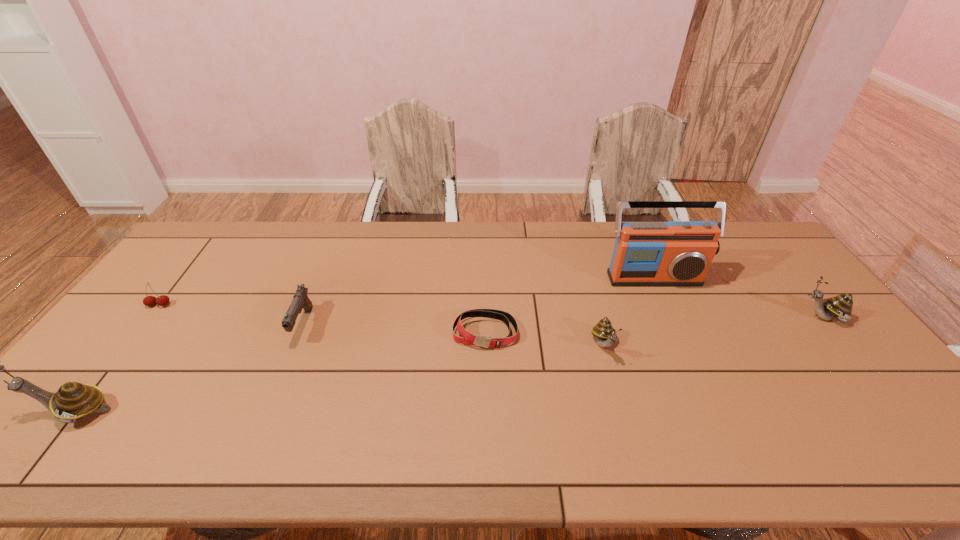
At what (x,y) coordinates should I click in order to perform the action: click on the nearest snail. Please return your answer as a coordinate pair (x, y). This screenshot has height=540, width=960. Looking at the image, I should click on (73, 401).

Find the location of a particular element. The image size is (960, 540). the leftmost snail is located at coordinates (73, 401).

Locate an element on the screen. the fourth tallest object is located at coordinates (606, 335).

In order to click on the second snail from right to left in this screenshot , I will do `click(606, 335)`.

What are the coordinates of `the third tallest object` in the screenshot? It's located at (839, 307).

I want to click on the rightmost object, so click(839, 307).

Locate an element on the screen. This screenshot has height=540, width=960. the second object from right to left is located at coordinates (676, 253).

You are a GUI agent. You are given a task and a screenshot of the screen. Output one action in this format:
    pyautogui.click(x=<x>, y=<y>)
    Task: Click on the tallest object
    Image resolution: width=960 pixels, height=540 pixels.
    Given the screenshot: What is the action you would take?
    pyautogui.click(x=676, y=253)

Where is `the third object from left to right`? This screenshot has height=540, width=960. the third object from left to right is located at coordinates (300, 301).

The height and width of the screenshot is (540, 960). Identify the location of the shortest object. (467, 338).